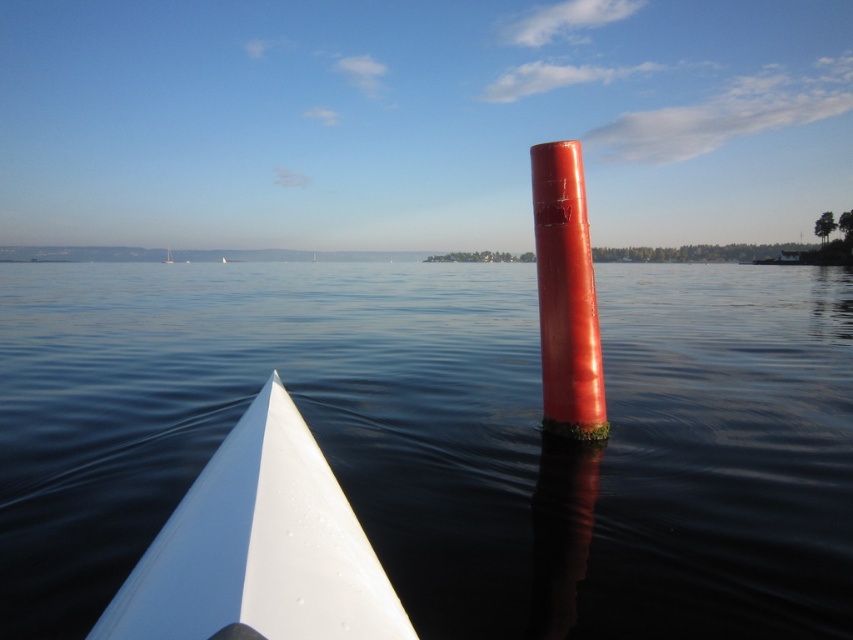
You are a sailor trying to navigate through the water. You see the smooth water at center and the glossy red pole at center. Which one is higher in the image?

The smooth water at center is higher than the glossy red pole at center in the image.

You are standing on the deck of a boat and see the smooth water at center and the glossy red pole at center. Which object is nearer to you?

The smooth water at center is closer to the viewer than the glossy red pole at center.

You are standing on the deck of a ship and want to determine which object is taller between the white glossy boat at lower left and the glossy red pole at center. Based on the scene, which one is taller?

The glossy red pole at center is taller than the white glossy boat at lower left.